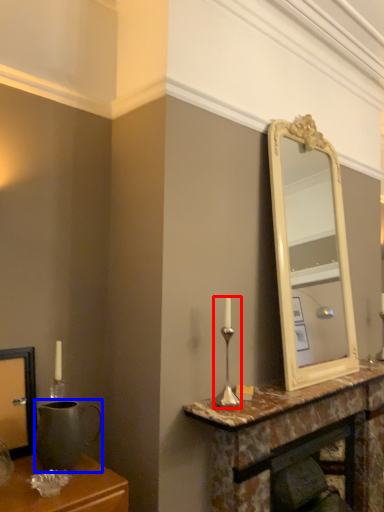
Question: Which object is further to the camera taking this photo, candle holder (highlighted by a red box) or gray (highlighted by a blue box)?

Choices:
 (A) candle holder
 (B) gray

Answer: (A)